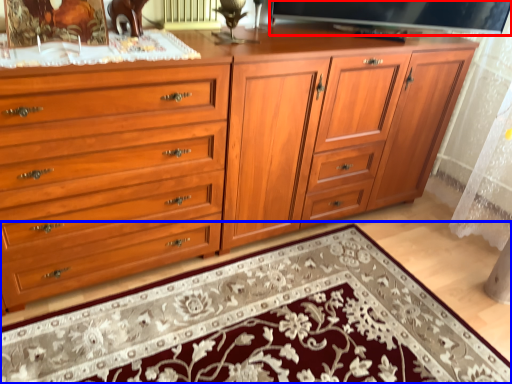
Question: Which point is further to the camera, television (highlighted by a red box) or mat (highlighted by a blue box)?

Choices:
 (A) television
 (B) mat

Answer: (A)